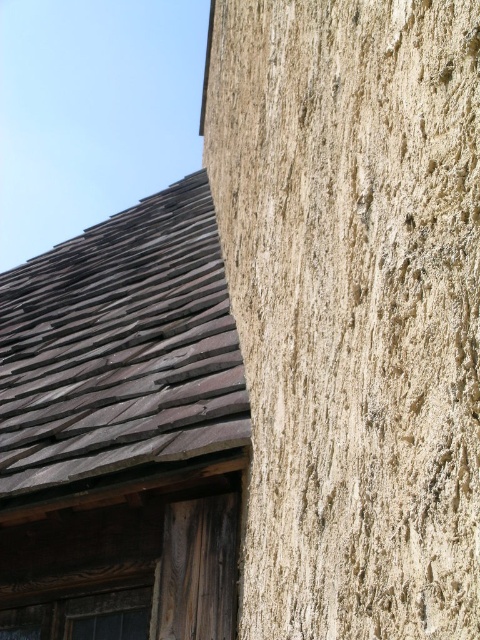
Who is lower down, dark brown shingles at upper left or wooden textured window at lower left?

wooden textured window at lower left is below.

Does dark brown shingles at upper left have a lesser height compared to wooden textured window at lower left?

No.

Is point (36, 388) farther from camera compared to point (128, 620)?

That is True.

Image resolution: width=480 pixels, height=640 pixels. What are the coordinates of `dark brown shingles at upper left` in the screenshot? It's located at (120, 348).